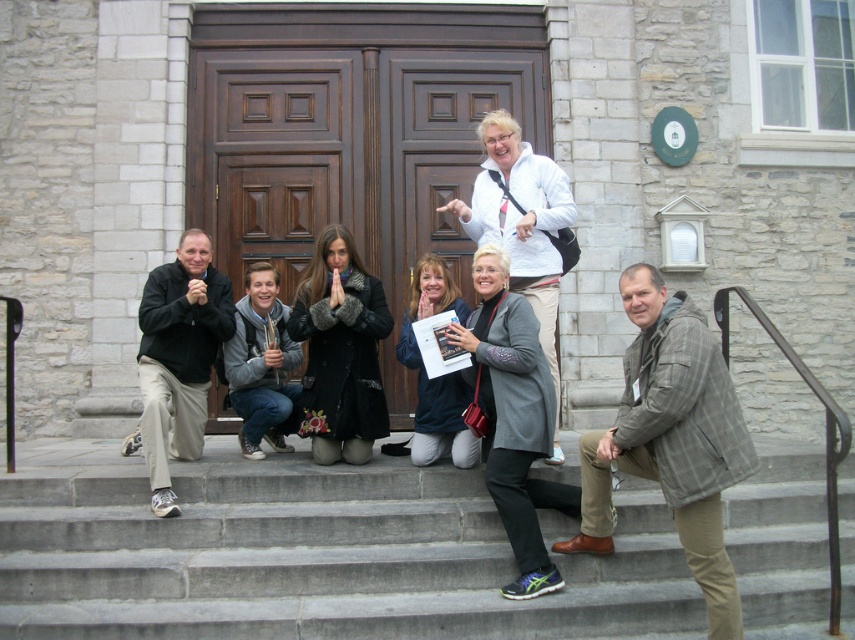
Is gray plaid jacket at center shorter than black matte pants at lower left?

In fact, gray plaid jacket at center may be taller than black matte pants at lower left.

Is gray plaid jacket at center positioned in front of black matte pants at lower left?

That is True.

Does point (641, 385) come in front of point (228, 324)?

Yes, it is in front of point (228, 324).

The image size is (855, 640). Find the location of `gray plaid jacket at center`. gray plaid jacket at center is located at coordinates (671, 440).

Is gray concrete stairs at center shorter than gray plaid jacket at center?

Indeed, gray concrete stairs at center has a lesser height compared to gray plaid jacket at center.

Can you confirm if gray concrete stairs at center is positioned to the right of gray plaid jacket at center?

In fact, gray concrete stairs at center is to the left of gray plaid jacket at center.

Is point (612, 557) positioned after point (610, 525)?

Yes, point (612, 557) is farther from viewer.

Locate an element on the screen. Image resolution: width=855 pixels, height=640 pixels. gray concrete stairs at center is located at coordinates (307, 554).

Which of these two, gray concrete stairs at center or black matte pants at lower left, stands taller?

black matte pants at lower left

At what (x,y) coordinates should I click in order to perform the action: click on gray concrete stairs at center. Please return your answer as a coordinate pair (x, y). This screenshot has width=855, height=640. Looking at the image, I should click on (307, 554).

Where is `gray concrete stairs at center`? gray concrete stairs at center is located at coordinates (307, 554).